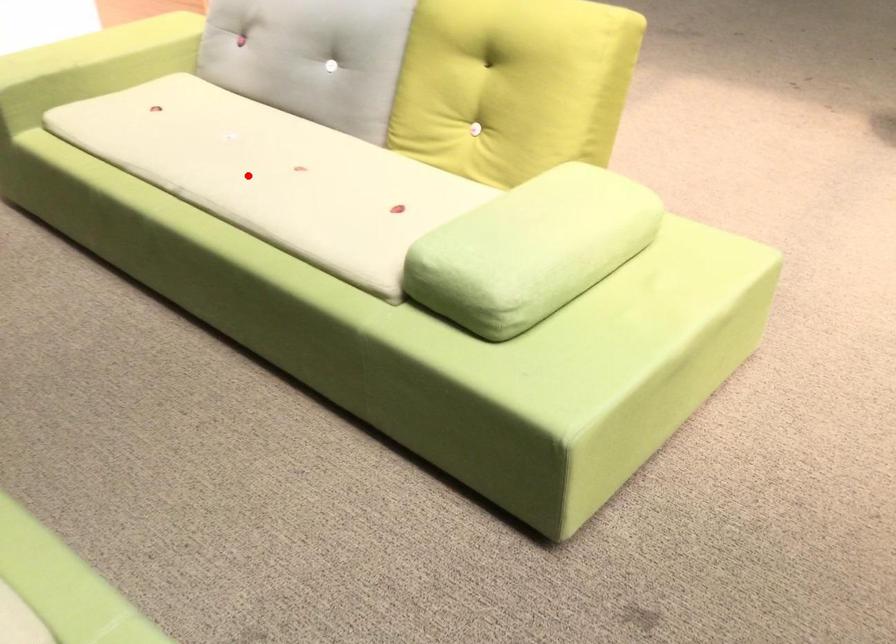
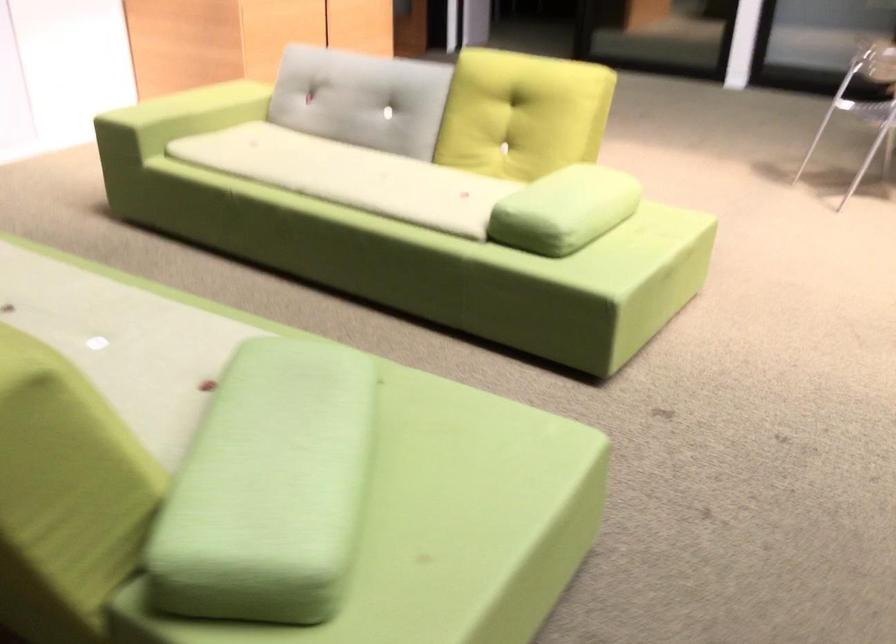
Question: A red point is marked in image1. In image2, is the corresponding 3D point closer to the camera or farther? Reply with the corresponding letter.

Choices:
 (A) The corresponding 3D point is closer.
 (B) The corresponding 3D point is farther.

Answer: (B)